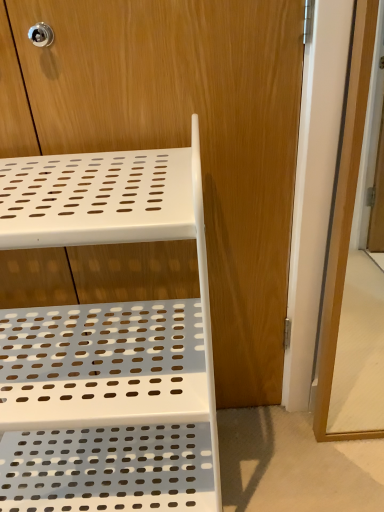
Describe the element at coordinates (107, 345) in the screenshot. This screenshot has width=384, height=512. I see `white plastic shelf at upper left` at that location.

This screenshot has height=512, width=384. I want to click on transparent glass screen door at right, so pyautogui.click(x=345, y=215).

I want to click on white plastic shelf at upper left, so click(107, 345).

Is transparent glass screen door at right bigger than white plastic shelf at center?

Incorrect, transparent glass screen door at right is not larger than white plastic shelf at center.

Considering the relative sizes of transparent glass screen door at right and white plastic shelf at center in the image provided, is transparent glass screen door at right taller than white plastic shelf at center?

No, transparent glass screen door at right is not taller than white plastic shelf at center.

Can you confirm if transparent glass screen door at right is positioned to the left of white plastic shelf at center?

No.

Find the location of a particular element. furniture lying on the left of transparent glass screen door at right is located at coordinates (107, 345).

Is transparent glass screen door at right positioned with its back to white plastic shelf at upper left?

That's not correct — transparent glass screen door at right is not looking away from white plastic shelf at upper left.

From the image's perspective, does transparent glass screen door at right appear lower than white plastic shelf at upper left?

Incorrect, from the image's perspective, transparent glass screen door at right is higher than white plastic shelf at upper left.

Which is closer, (69,51) or (84,339)?

Point (69,51) is closer to the camera than point (84,339).

Is white plastic shelf at center bigger than white plastic shelf at upper left?

Incorrect, white plastic shelf at center is not larger than white plastic shelf at upper left.

In the image, is white plastic shelf at center positioned in front of or behind white plastic shelf at upper left?

In the image, white plastic shelf at center appears behind white plastic shelf at upper left.

From the picture: Can you confirm if white plastic shelf at center is thinner than white plastic shelf at upper left?

Correct, the width of white plastic shelf at center is less than that of white plastic shelf at upper left.

This screenshot has height=512, width=384. Find the location of `screen door in front of the white plastic shelf at center`. screen door in front of the white plastic shelf at center is located at coordinates (345, 215).

Considering the relative sizes of white plastic shelf at center and transparent glass screen door at right in the image provided, is white plastic shelf at center taller than transparent glass screen door at right?

Yes, white plastic shelf at center is taller than transparent glass screen door at right.

Considering the points (301, 2) and (366, 16), which point is behind, point (301, 2) or point (366, 16)?

The point (301, 2) is behind.

From the image's perspective, which is below, white plastic shelf at center or transparent glass screen door at right?

transparent glass screen door at right appears lower in the image.

Considering the positions of points (175, 236) and (195, 49), is point (175, 236) farther from camera compared to point (195, 49)?

No, it is not.

From the image's perspective, is white plastic shelf at upper left on top of white plastic shelf at center?

No.

In the scene shown: Is white plastic shelf at upper left oriented away from white plastic shelf at center?

Yes, white plastic shelf at center is at the back of white plastic shelf at upper left.

Consider the image. Is white plastic shelf at upper left spatially inside white plastic shelf at center, or outside of it?

The correct answer is: outside.

Is white plastic shelf at upper left facing towards transparent glass screen door at right?

No, white plastic shelf at upper left is not turned towards transparent glass screen door at right.

The width and height of the screenshot is (384, 512). I want to click on furniture in front of the transparent glass screen door at right, so click(107, 345).

How different are the orientations of white plastic shelf at upper left and transparent glass screen door at right in degrees?

1.01 degrees separate the facing orientations of white plastic shelf at upper left and transparent glass screen door at right.

From the image's perspective, is white plastic shelf at upper left located above transparent glass screen door at right?

Incorrect, from the image's perspective, white plastic shelf at upper left is lower than transparent glass screen door at right.

Identify the location of dresser behind the transparent glass screen door at right. The width and height of the screenshot is (384, 512). click(183, 137).

The height and width of the screenshot is (512, 384). Find the location of `furniture that appears below the transparent glass screen door at right (from the image's perspective)`. furniture that appears below the transparent glass screen door at right (from the image's perspective) is located at coordinates (107, 345).

When comparing their distances from white plastic shelf at upper left, does white plastic shelf at center or transparent glass screen door at right seem further?

Among the two, transparent glass screen door at right is located further to white plastic shelf at upper left.

From the image, which object appears to be farther from white plastic shelf at center, transparent glass screen door at right or white plastic shelf at upper left?

transparent glass screen door at right is positioned further to the anchor white plastic shelf at center.

Looking at the image, which one is located further to white plastic shelf at center, white plastic shelf at upper left or transparent glass screen door at right?

transparent glass screen door at right is positioned further to the anchor white plastic shelf at center.

When comparing their distances from transparent glass screen door at right, does white plastic shelf at upper left or white plastic shelf at center seem closer?

Among the two, white plastic shelf at center is located nearer to transparent glass screen door at right.

Estimate the real-world distances between objects in this image. Which object is further from white plastic shelf at upper left, transparent glass screen door at right or white plastic shelf at center?

transparent glass screen door at right is further to white plastic shelf at upper left.

Based on their spatial positions, is white plastic shelf at center or white plastic shelf at upper left closer to transparent glass screen door at right?

Based on the image, white plastic shelf at center appears to be nearer to transparent glass screen door at right.

At what (x,y) coordinates should I click in order to perform the action: click on dresser situated between white plastic shelf at upper left and transparent glass screen door at right from left to right. Please return your answer as a coordinate pair (x, y). The width and height of the screenshot is (384, 512). Looking at the image, I should click on (183, 137).